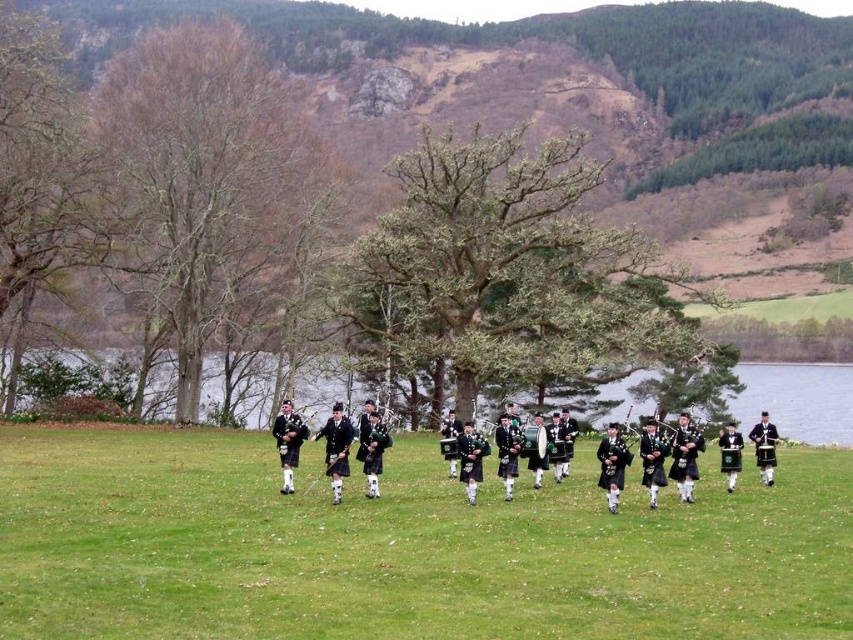
Question: Which is nearer to the bare wood at left?

Choices:
 (A) green grass at center
 (B) green leafy tree at center

Answer: (B)

Question: Is green grass at center above green leafy tree at center?

Choices:
 (A) yes
 (B) no

Answer: (B)

Question: Which object appears closest to the camera in this image?

Choices:
 (A) green grass at center
 (B) bare wood at left
 (C) green leafy tree at center

Answer: (A)

Question: Does green grass at center have a larger size compared to bare wood at left?

Choices:
 (A) yes
 (B) no

Answer: (B)

Question: From the image, what is the correct spatial relationship of green leafy tree at center in relation to bare wood at left?

Choices:
 (A) below
 (B) above

Answer: (A)

Question: Which object is farther from the camera taking this photo?

Choices:
 (A) green leafy tree at center
 (B) bare wood at left

Answer: (B)